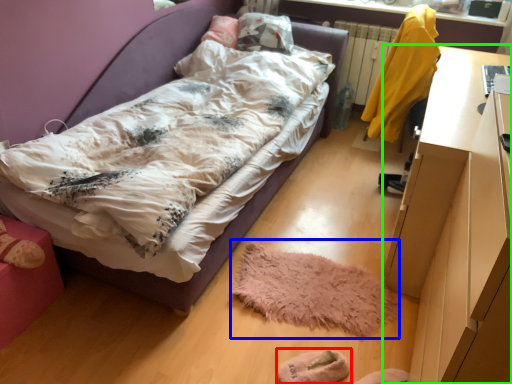
Question: Estimate the real-world distances between objects in this image. Which object is farther from footwear (highlighted by a red box), mat (highlighted by a blue box) or desk (highlighted by a green box)?

Choices:
 (A) mat
 (B) desk

Answer: (B)